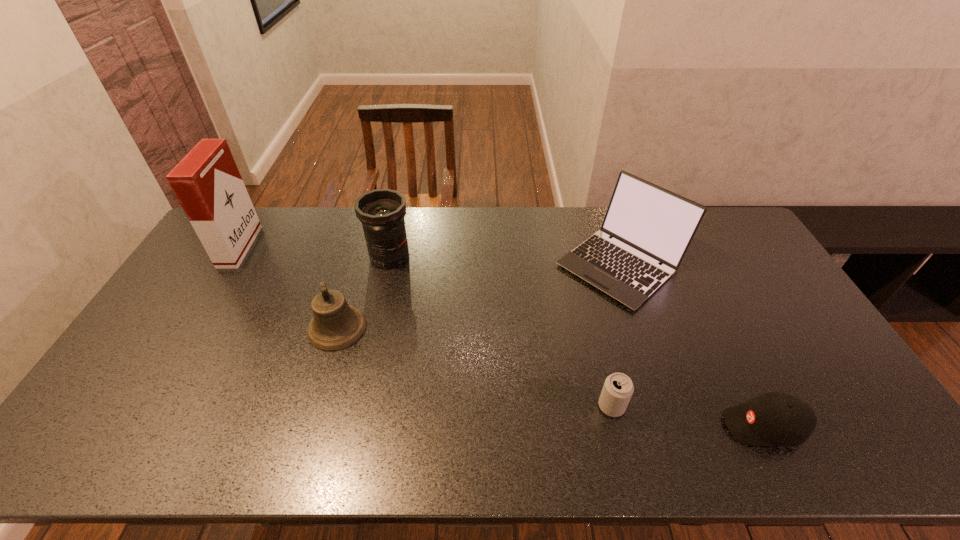
Locate an element on the screen. free spot between the telephoto lens and the fourth tallest object is located at coordinates (364, 292).

Find the location of a particular element. Image resolution: width=960 pixels, height=540 pixels. free spot between the baseball cap and the can is located at coordinates (687, 416).

Find the location of a particular element. vacant point located between the telephoto lens and the can is located at coordinates (501, 332).

Identify the location of vacant area between the laptop_computer and the baseball cap. The image size is (960, 540). (691, 346).

This screenshot has height=540, width=960. I want to click on vacant region between the baseball cap and the telephoto lens, so click(x=577, y=341).

The image size is (960, 540). What are the coordinates of `free point between the can and the fourth tallest object` in the screenshot? It's located at (474, 367).

Where is `free space between the can and the baseball cap`? This screenshot has height=540, width=960. free space between the can and the baseball cap is located at coordinates coord(687,416).

This screenshot has width=960, height=540. What are the coordinates of `vacant area between the laptop_computer and the telephoto lens` in the screenshot? It's located at (505, 261).

Point out which object is positioned as the nearest to the leftmost object. Please provide its 2D coordinates. Your answer should be formatted as a tuple, i.e. [(x, y)], where the tuple contains the x and y coordinates of a point satisfying the conditions above.

[(336, 325)]

Identify which object is the closest to the bell. Please provide its 2D coordinates. Your answer should be formatted as a tuple, i.e. [(x, y)], where the tuple contains the x and y coordinates of a point satisfying the conditions above.

[(381, 211)]